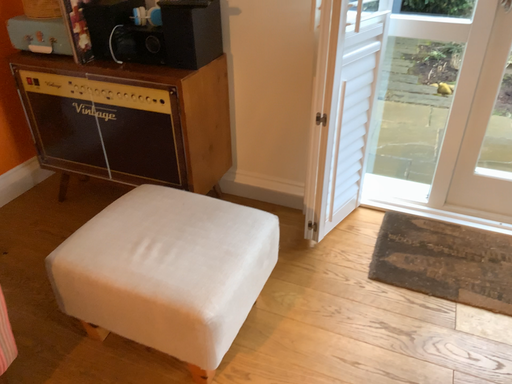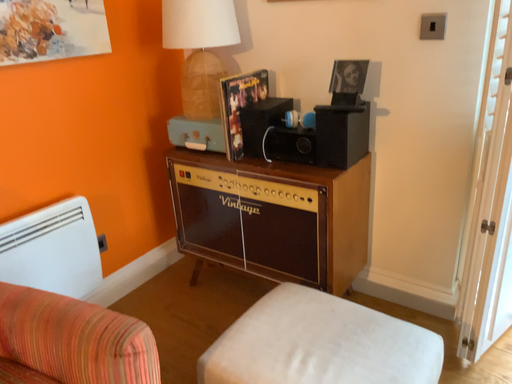
Question: Which way did the camera rotate in the video?

Choices:
 (A) rotated downward
 (B) rotated upward

Answer: (B)